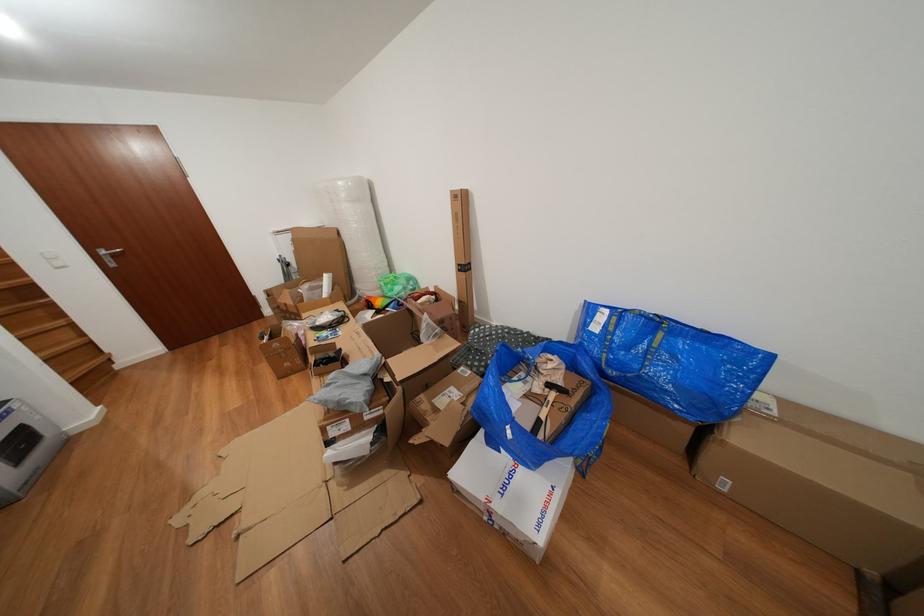
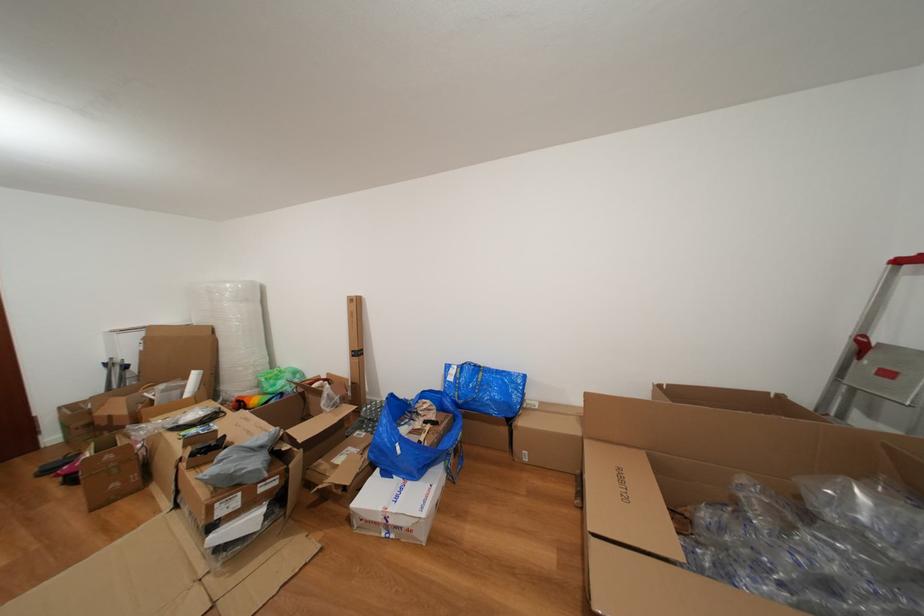
Question: I am providing you with two images of the same scene from different viewpoints. After the viewpoint changes to image2, which objects are now occluded?

Choices:
 (A) blue bag handle
 (B) large plastic roll
 (C) tall cardboard box
 (D) none of these

Answer: (D)